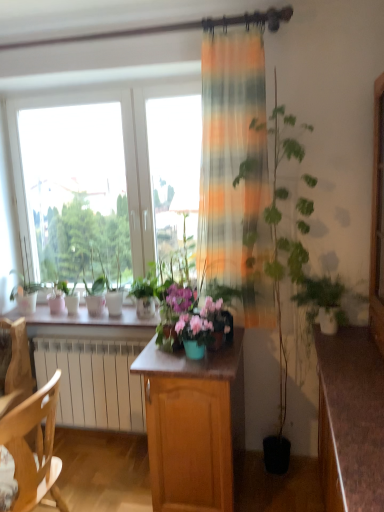
Where is `vacant area that is in front of matte plastic flower box at center`? The image size is (384, 512). vacant area that is in front of matte plastic flower box at center is located at coordinates (200, 367).